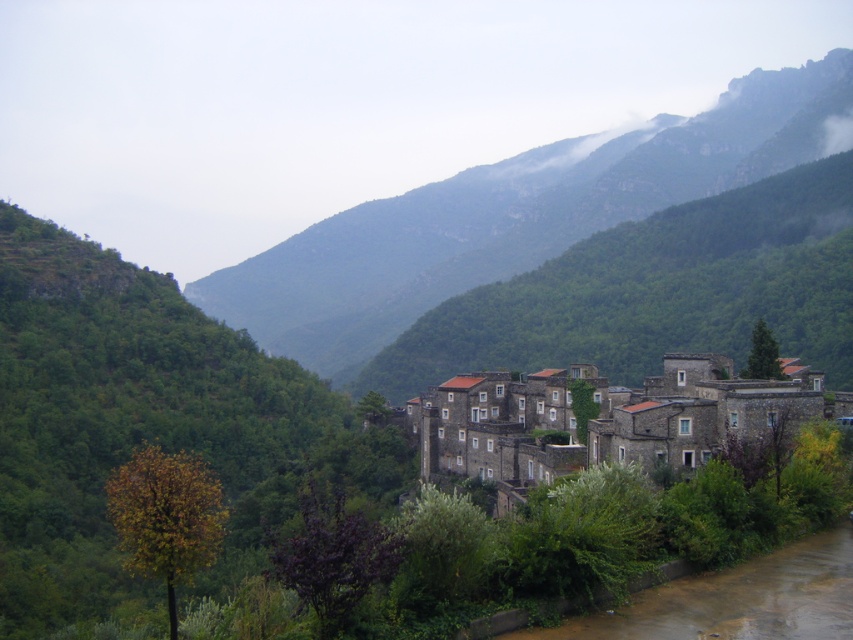
Does green rocky mountain at center appear on the right side of brown muddy water at lower right?

Yes, green rocky mountain at center is to the right of brown muddy water at lower right.

Which is below, green rocky mountain at center or brown muddy water at lower right?

brown muddy water at lower right is below.

Find the location of a particular element. green rocky mountain at center is located at coordinates (515, 216).

Who is positioned more to the left, stone village at center or brown muddy water at lower right?

Positioned to the left is stone village at center.

Between point (662, 416) and point (804, 557), which one is positioned behind?

The point (662, 416) is behind.

At what (x,y) coordinates should I click in order to perform the action: click on stone village at center. Please return your answer as a coordinate pair (x, y). Image resolution: width=853 pixels, height=640 pixels. Looking at the image, I should click on (606, 419).

Does point (213, 280) lie behind point (509, 390)?

Yes, point (213, 280) is farther from viewer.

Who is more forward, (x=750, y=179) or (x=590, y=426)?

Point (x=590, y=426) is more forward.

Image resolution: width=853 pixels, height=640 pixels. I want to click on green rocky mountain at center, so click(x=515, y=216).